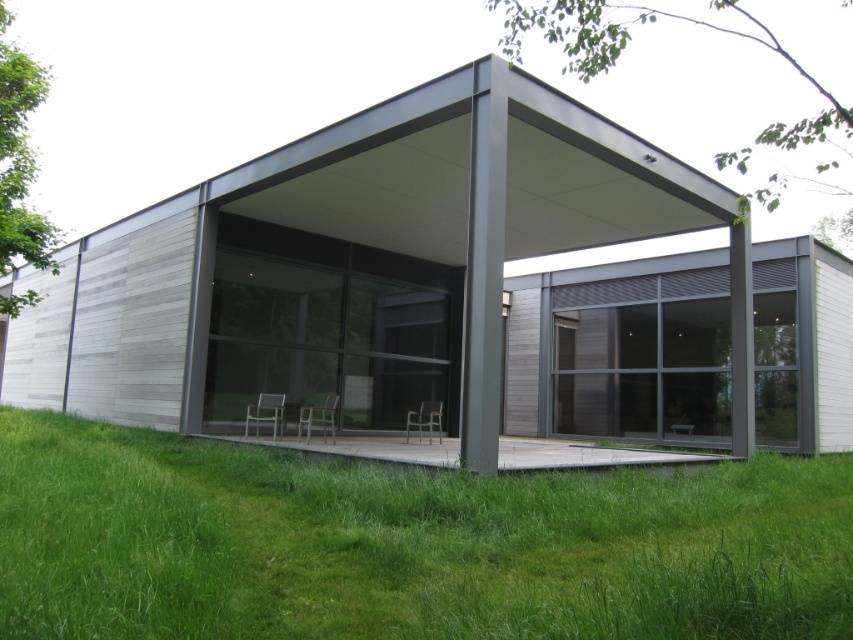
What do you see at coordinates (378, 269) in the screenshot?
I see `matte gray shelter at center` at bounding box center [378, 269].

Is matte gray shelter at center bigger than green grass at lower center?

Yes.

Is point (271, 189) positioned in front of point (201, 627)?

No, (271, 189) is behind (201, 627).

The width and height of the screenshot is (853, 640). In order to click on matte gray shelter at center in this screenshot , I will do `click(378, 269)`.